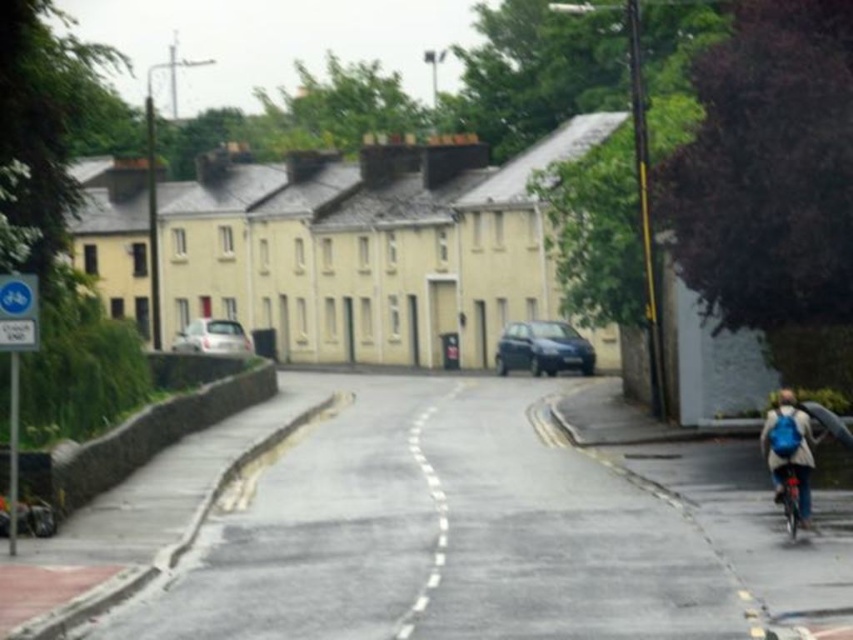
Question: Which object appears farthest from the camera in this image?

Choices:
 (A) gray asphalt bike lane at center
 (B) white glossy car at center

Answer: (B)

Question: Is dark blue metallic car at center smaller than white glossy car at center?

Choices:
 (A) yes
 (B) no

Answer: (A)

Question: Which of these objects is positioned farthest from the white glossy car at center?

Choices:
 (A) gray asphalt bike lane at center
 (B) metallic blue bicycle at lower right

Answer: (B)

Question: Is gray asphalt bike lane at center behind white glossy car at center?

Choices:
 (A) no
 (B) yes

Answer: (A)

Question: Is the position of gray asphalt bike lane at center more distant than that of metallic blue bicycle at lower right?

Choices:
 (A) no
 (B) yes

Answer: (A)

Question: Which point is closer to the camera taking this photo?

Choices:
 (A) (544, 353)
 (B) (782, 513)
 (C) (465, 456)
 (D) (225, 330)

Answer: (B)